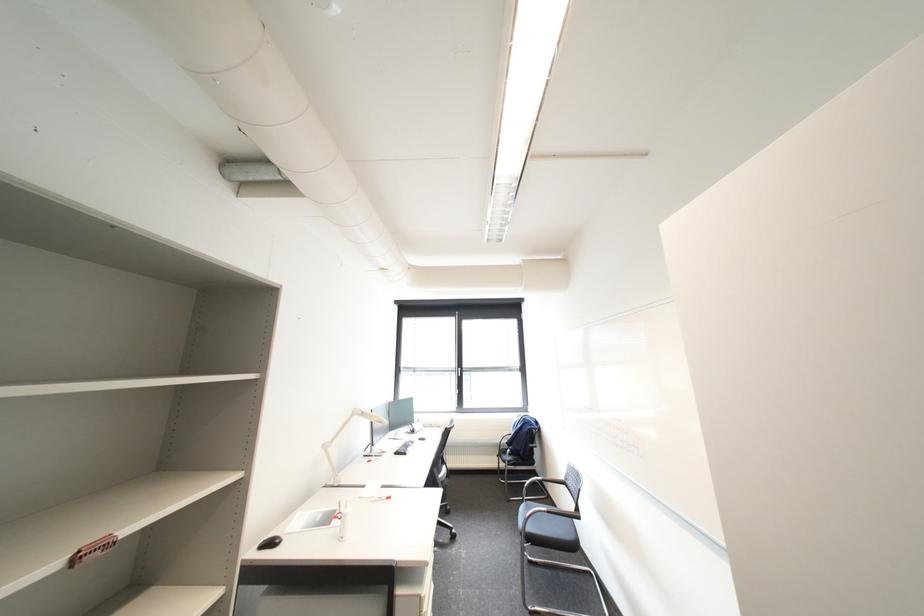
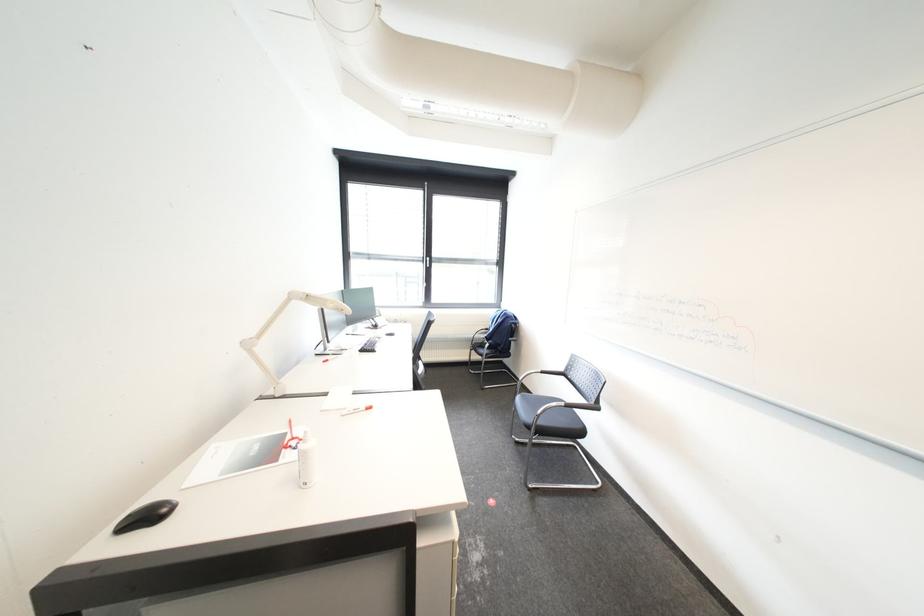
Question: Based on the continuous images, in which direction is the camera rotating? Reply with the corresponding letter.

Choices:
 (A) Left
 (B) Right
 (C) Up
 (D) Down

Answer: (D)